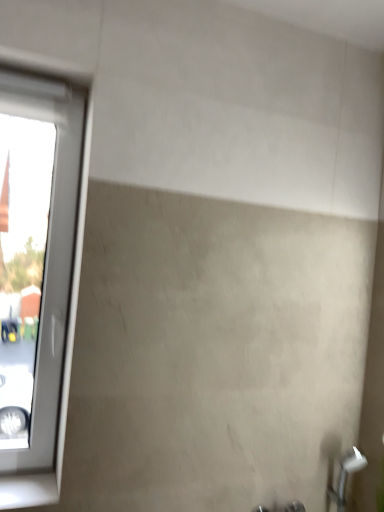
Measure the distance between white plastic window at left and camera.

white plastic window at left and camera are 2.64 meters apart from each other.

The width and height of the screenshot is (384, 512). Identify the location of white plastic window at left. (35, 274).

This screenshot has height=512, width=384. What do you see at coordinates (35, 274) in the screenshot? I see `white plastic window at left` at bounding box center [35, 274].

The width and height of the screenshot is (384, 512). Identify the location of white plastic window at left. (35, 274).